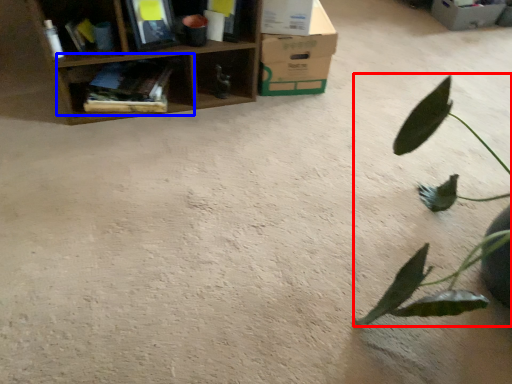
Question: Which point is further to the camera, houseplant (highlighted by a red box) or shelf (highlighted by a blue box)?

Choices:
 (A) houseplant
 (B) shelf

Answer: (B)